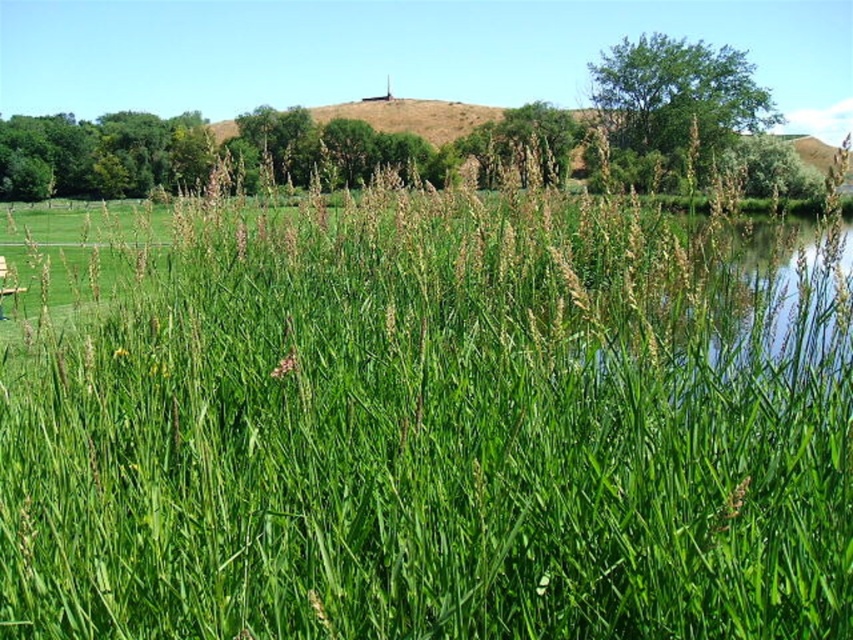
You are a photographer setting up a tripod to capture the green leafy grass at center and the wooden park bench at lower left. Based on their positions, which object should you focus on first if you want to ensure both are in sharp focus?

The wooden park bench at lower left should be focused on first because it is closer to the photographer than the green leafy grass at center, which is located above it and farther away.